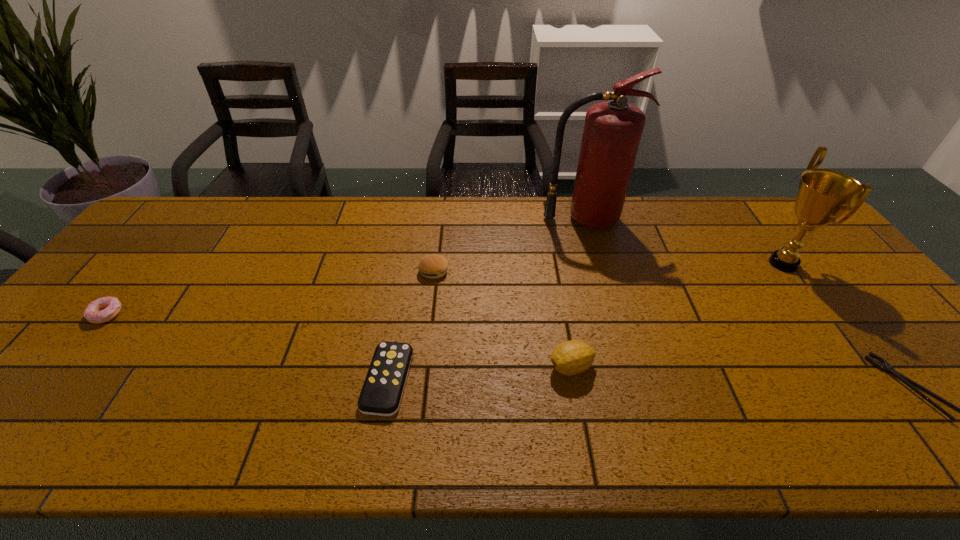
You are a GUI agent. You are given a task and a screenshot of the screen. Output one action in this format:
    pyautogui.click(x=<x>, y=<y>)
    Task: Click on the free space located on the front view with handles of the sixth shortest object
    
    Given the screenshot: What is the action you would take?
    pyautogui.click(x=725, y=264)

You are a GUI agent. You are given a task and a screenshot of the screen. Output one action in this format:
    pyautogui.click(x=<x>, y=<y>)
    Task: Click on the vacant space located on the front view with handles of the sixth shortest object
    
    Given the screenshot: What is the action you would take?
    pyautogui.click(x=641, y=264)

What are the coordinates of `vacant space located at the stem end of the lemon` in the screenshot? It's located at (405, 367).

Find the location of a particular element. The height and width of the screenshot is (540, 960). vacant area situated 0.180m at the stem end of the lemon is located at coordinates (472, 367).

Identify the location of free space located 0.360m at the stem end of the lemon. (396, 367).

Locate an element on the screen. The image size is (960, 540). vacant space located 0.240m on the front of the fourth tallest object is located at coordinates click(x=425, y=350).

You are a GUI agent. You are given a task and a screenshot of the screen. Output one action in this format:
    pyautogui.click(x=<x>, y=<y>)
    Task: Click on the free space located 0.250m on the back of the leftmost object
    The height and width of the screenshot is (540, 960).
    Given the screenshot: What is the action you would take?
    pyautogui.click(x=163, y=244)

You are a GUI agent. You are given a task and a screenshot of the screen. Output one action in this format:
    pyautogui.click(x=<x>, y=<y>)
    Task: Click on the free region located 0.270m on the back of the remote control
    The image size is (960, 540).
    Given the screenshot: What is the action you would take?
    pyautogui.click(x=407, y=272)

The width and height of the screenshot is (960, 540). In order to click on object located in the far edge section of the desktop in this screenshot , I will do click(612, 132).

Identify the location of object present at the near edge. (382, 391).